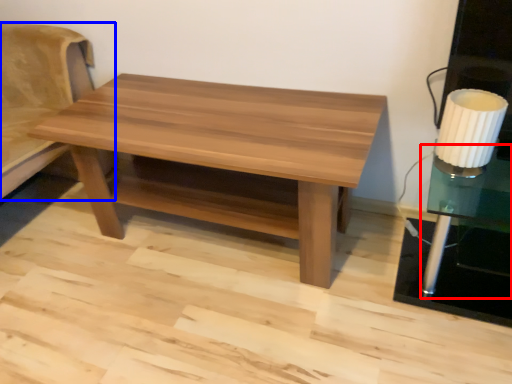
Question: Which of the following is the farthest to the observer, side table (highlighted by a red box) or futon (highlighted by a blue box)?

Choices:
 (A) side table
 (B) futon

Answer: (B)